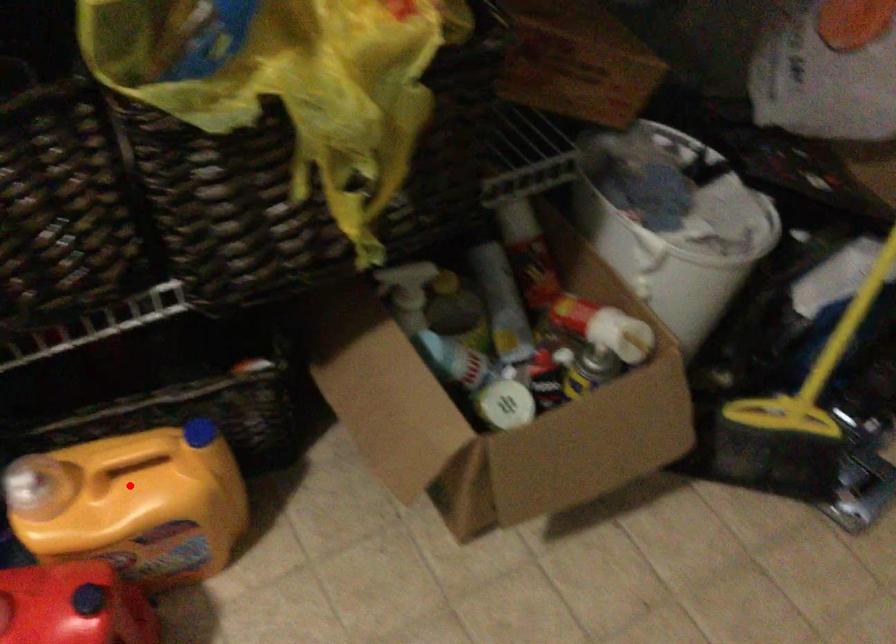
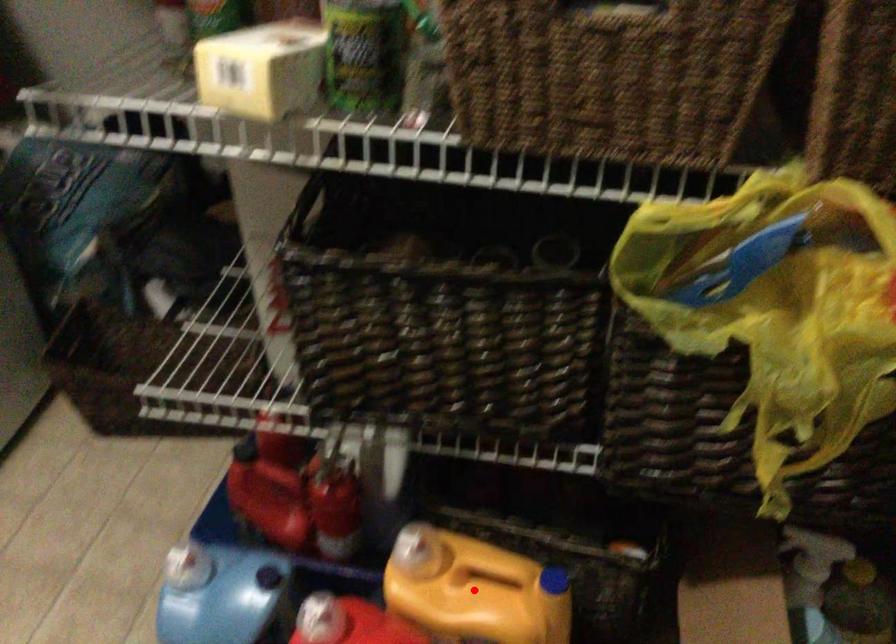
I am providing you with two images of the same scene from different viewpoints. A red point is marked on the first image and another point is marked on the second image. Does the point marked in image1 correspond to the same location as the one in image2?

Yes